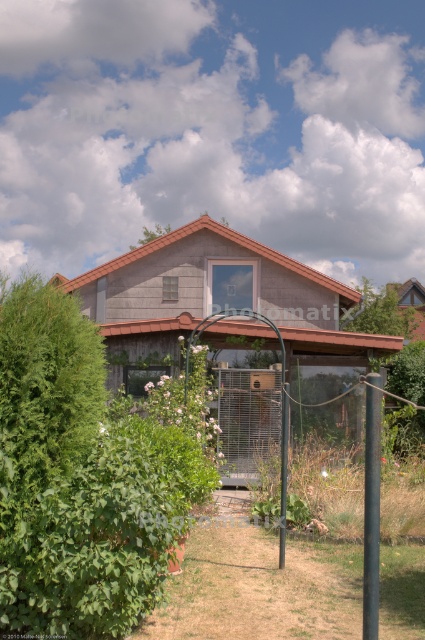
Question: Which object is the farthest from the metallic pole at center-right?

Choices:
 (A) metallic pole at center
 (B) green wood garden at center

Answer: (A)

Question: Which object is closer to the camera taking this photo?

Choices:
 (A) metallic pole at center-right
 (B) metallic pole at center

Answer: (A)

Question: Where is green wood garden at center located in relation to metallic pole at center-right in the image?

Choices:
 (A) left
 (B) right

Answer: (A)

Question: Among these points, which one is nearest to the camera?

Choices:
 (A) (127, 419)
 (B) (286, 429)

Answer: (B)

Question: Is metallic pole at center-right positioned at the back of metallic pole at center?

Choices:
 (A) yes
 (B) no

Answer: (B)

Question: Is metallic pole at center-right bigger than metallic pole at center?

Choices:
 (A) no
 (B) yes

Answer: (B)